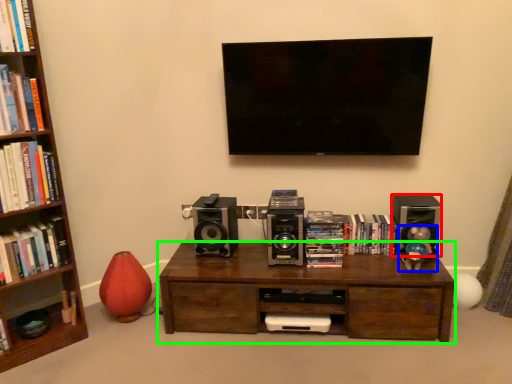
Question: Which object is positioned farthest from speaker (highlighted by a red box)? Select from toy (highlighted by a blue box) and table (highlighted by a green box).

Choices:
 (A) toy
 (B) table

Answer: (B)